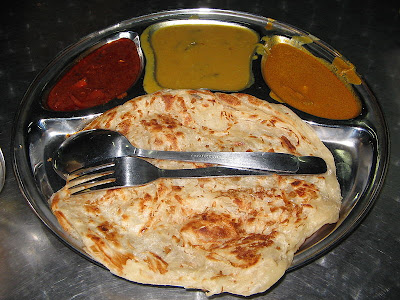
The image size is (400, 300). Find the location of `fork`. fork is located at coordinates (123, 170).